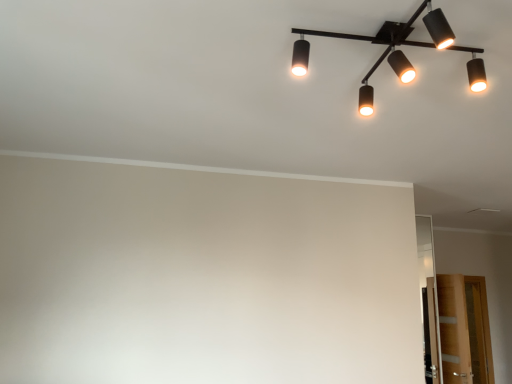
Question: Do you think matte black light fixture at upper center is within transparent glass door at lower right, or outside of it?

Choices:
 (A) outside
 (B) inside

Answer: (A)

Question: Is point (314, 31) closer or farther from the camera than point (468, 352)?

Choices:
 (A) closer
 (B) farther

Answer: (A)

Question: In the image, is matte black light fixture at upper center positioned in front of or behind transparent glass door at lower right?

Choices:
 (A) front
 (B) behind

Answer: (A)

Question: Is transparent glass door at lower right taller or shorter than matte black light fixture at upper center?

Choices:
 (A) tall
 (B) short

Answer: (A)

Question: Considering their positions, is transparent glass door at lower right located in front of or behind matte black light fixture at upper center?

Choices:
 (A) behind
 (B) front

Answer: (A)

Question: Choose the correct answer: Is transparent glass door at lower right inside matte black light fixture at upper center or outside it?

Choices:
 (A) outside
 (B) inside

Answer: (A)

Question: Based on their sizes in the image, would you say transparent glass door at lower right is bigger or smaller than matte black light fixture at upper center?

Choices:
 (A) small
 (B) big

Answer: (B)